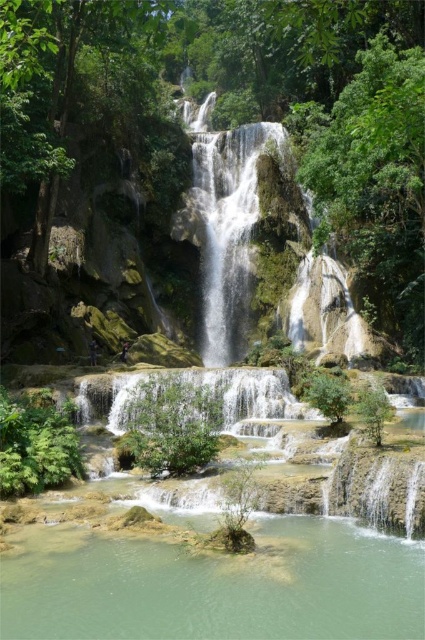
Question: Can you confirm if clear water at center is smaller than translucent white water at center?

Choices:
 (A) no
 (B) yes

Answer: (B)

Question: Which point is closer to the camera taking this photo?

Choices:
 (A) (257, 394)
 (B) (204, 150)

Answer: (A)

Question: Can you confirm if clear water at center is thinner than translucent white water at center?

Choices:
 (A) no
 (B) yes

Answer: (A)

Question: Does clear water at center have a greater width compared to translucent white water at center?

Choices:
 (A) no
 (B) yes

Answer: (B)